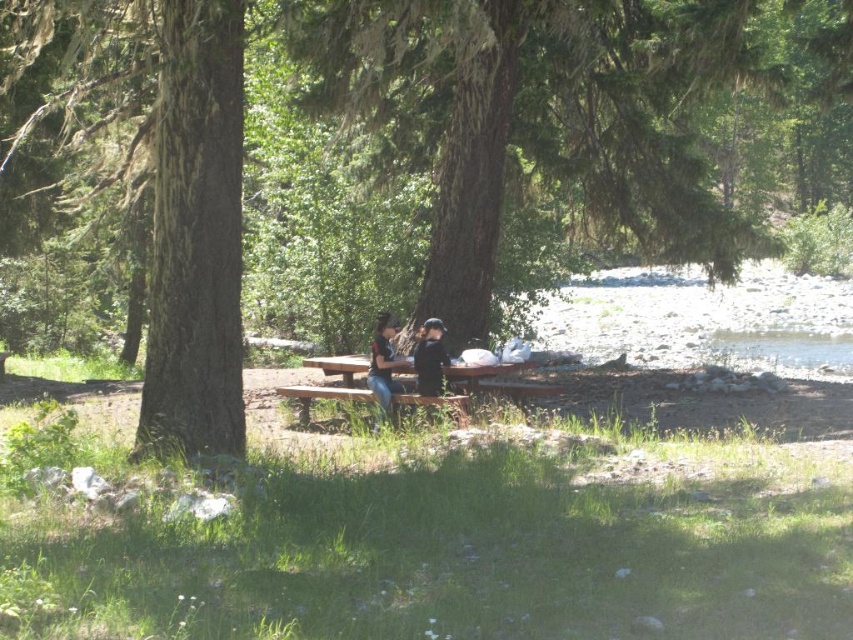
Can you confirm if green rough bark tree at center is bigger than matte black shirts at center?

Yes.

This screenshot has width=853, height=640. Identify the location of green rough bark tree at center. (405, 157).

Is point (209, 394) positioned after point (401, 358)?

No, it is not.

Based on the photo, who is higher up, green mossy tree trunk at center or matte black shirts at center?

green mossy tree trunk at center

Which is in front, point (238, 22) or point (415, 346)?

Point (238, 22) is more forward.

Locate an element on the screen. The height and width of the screenshot is (640, 853). green mossy tree trunk at center is located at coordinates (196, 236).

Is matte black shirts at center to the left of brown wooden bench at center from the viewer's perspective?

Incorrect, matte black shirts at center is not on the left side of brown wooden bench at center.

Between matte black shirts at center and brown wooden bench at center, which one is positioned higher?

matte black shirts at center is above.

Between point (383, 394) and point (372, 401), which one is positioned behind?

The point (372, 401) is behind.

In order to click on matte black shirts at center in this screenshot , I will do `click(404, 362)`.